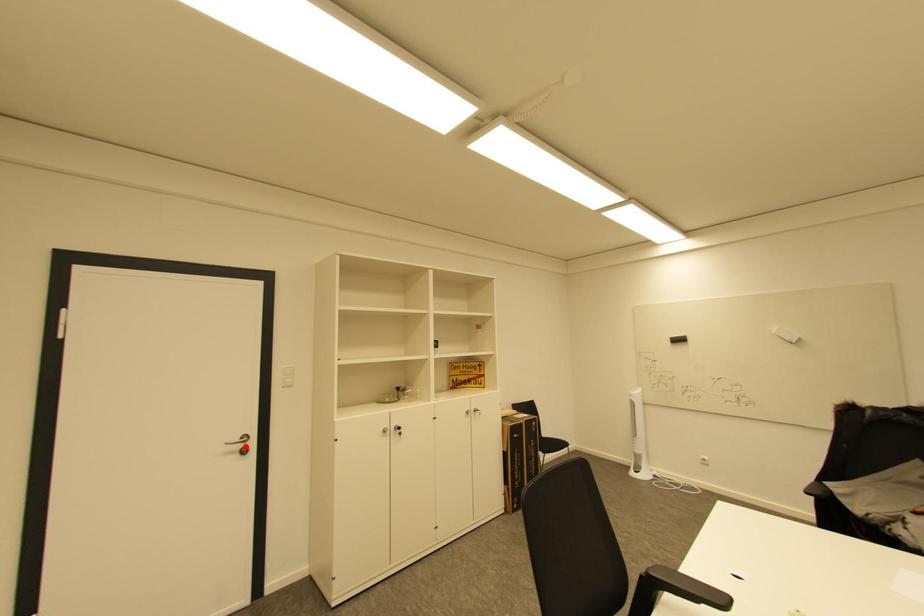
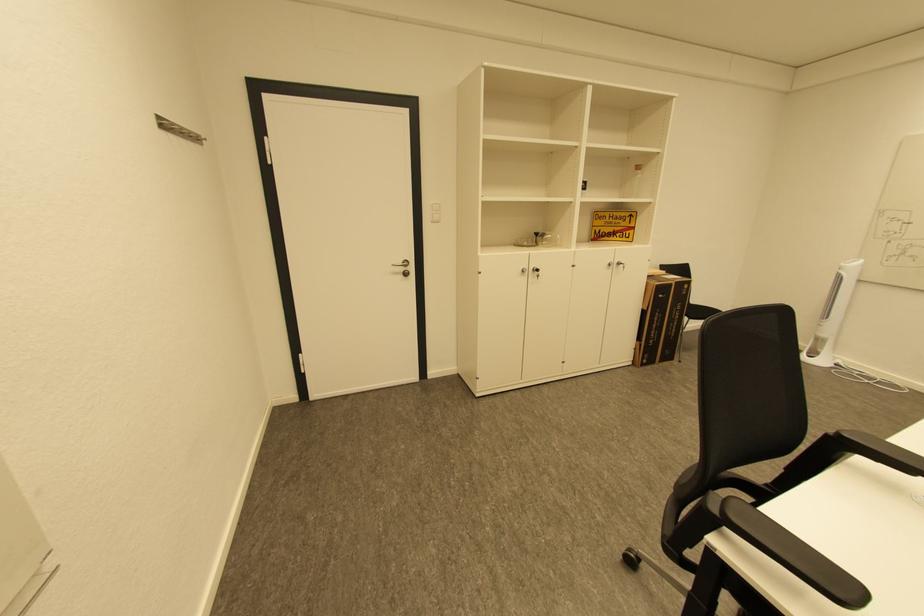
Find the pixel in the second image that matches the highlighted location in the first image.

(408, 270)